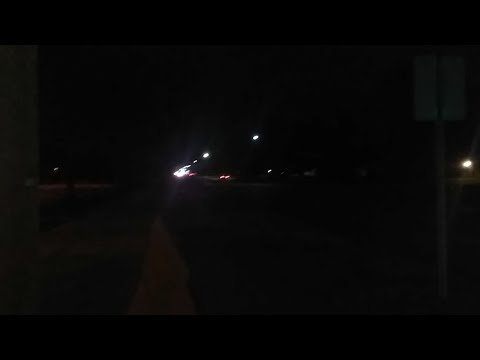
The width and height of the screenshot is (480, 360). Find the location of `lights`. lights is located at coordinates (206, 152).